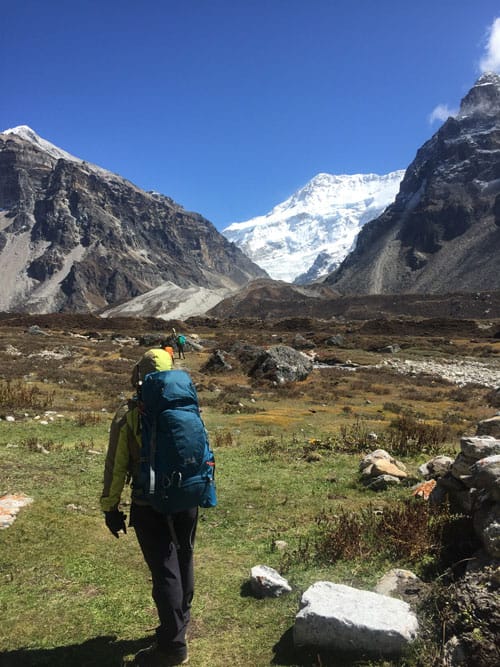
The height and width of the screenshot is (667, 500). In order to click on shoe in this screenshot , I will do `click(158, 653)`.